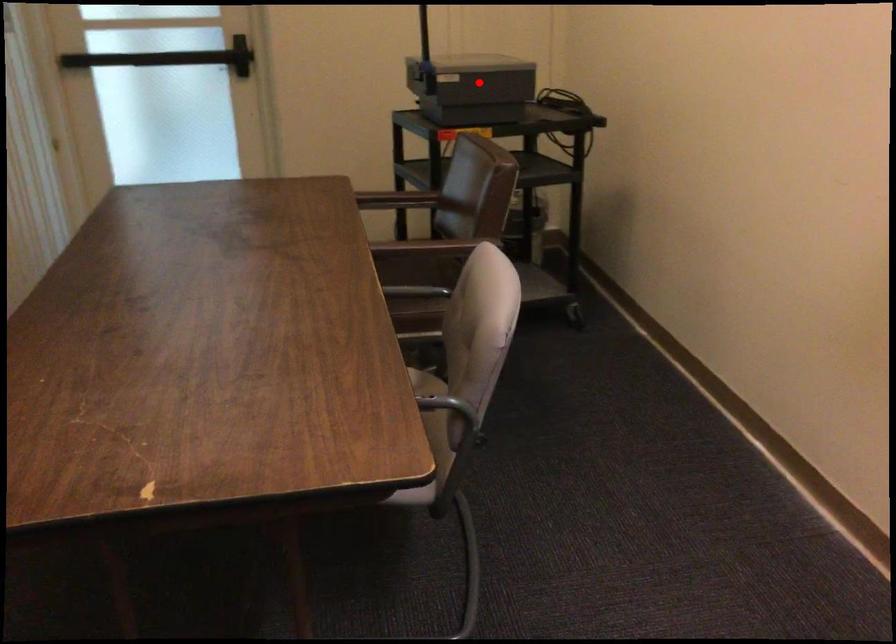
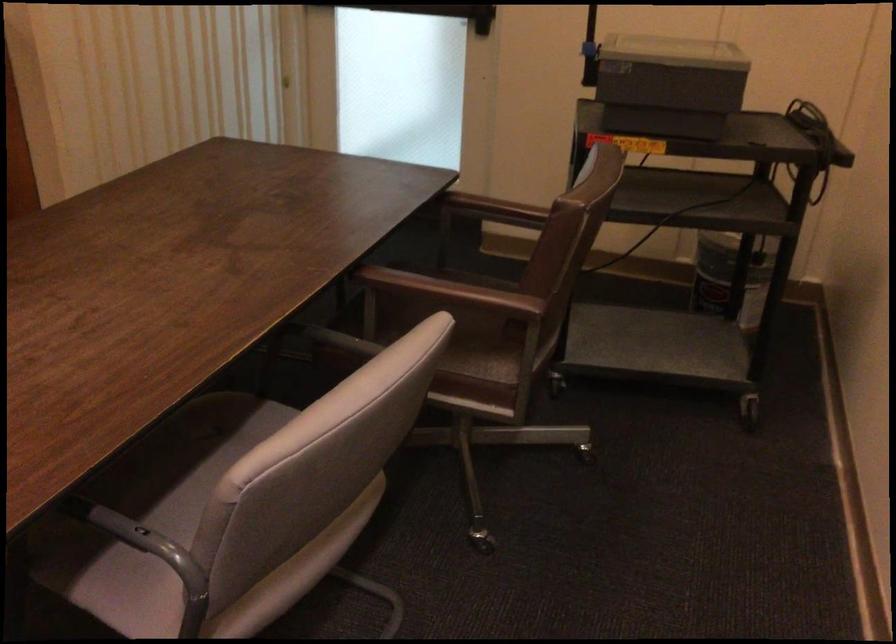
Question: I am providing you with two images of the same scene from different viewpoints. In image1, a red point is highlighted. Considering the same 3D point in image2, which of the following is correct?

Choices:
 (A) It is closer
 (B) It is farther

Answer: (A)